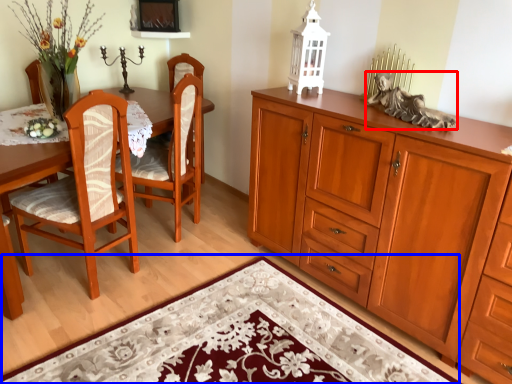
Question: Among these objects, which one is nearest to the camera, person (highlighted by a red box) or doormat (highlighted by a blue box)?

Choices:
 (A) person
 (B) doormat

Answer: (B)